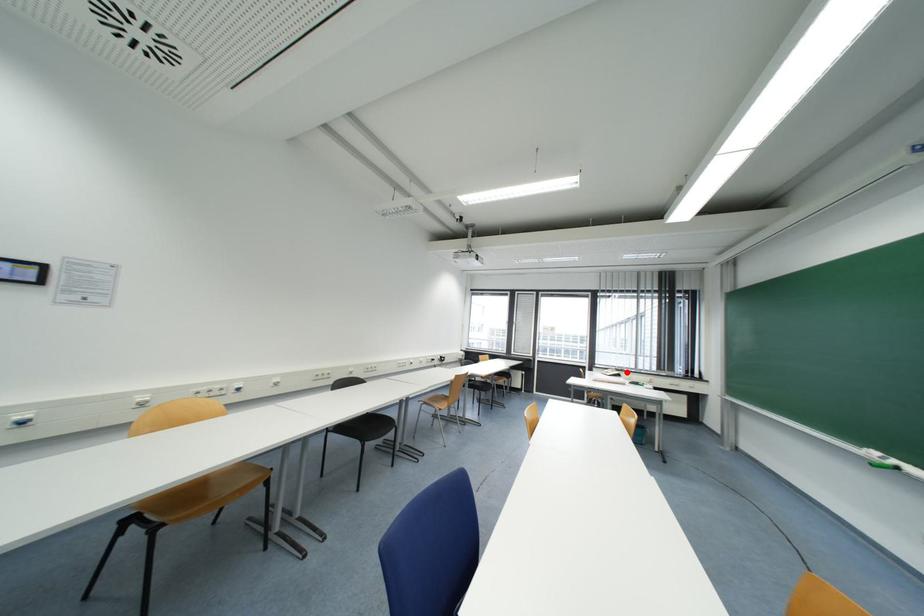
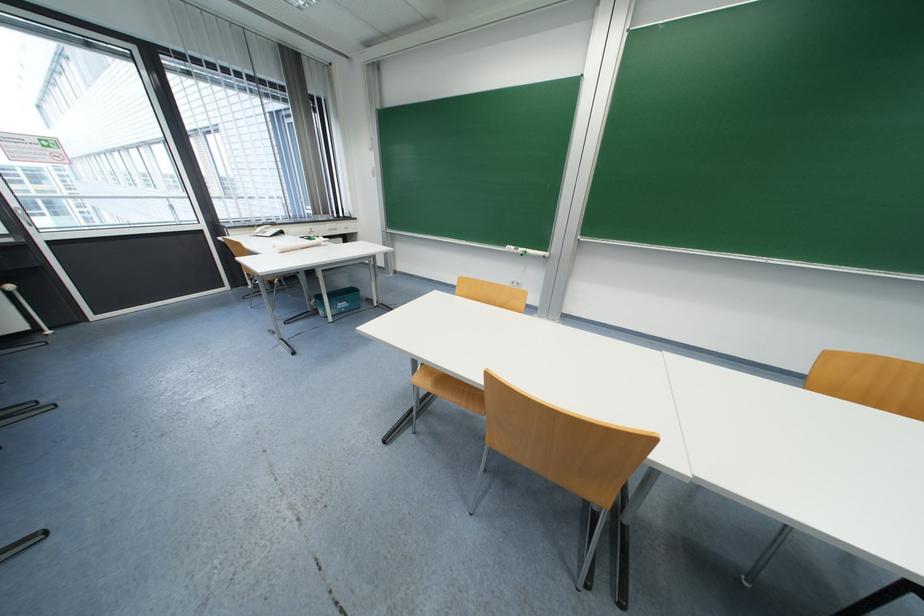
The point at the highlighted location is marked in the first image. Where is the corresponding point in the second image?

(277, 225)